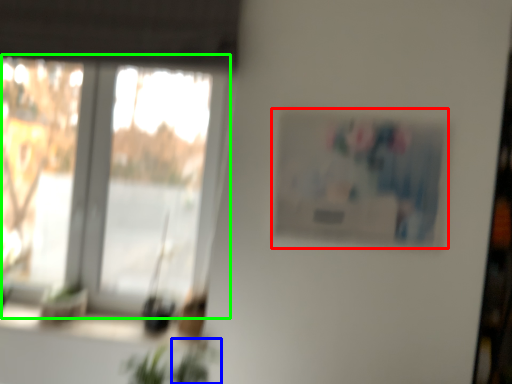
Question: Estimate the real-world distances between objects in this image. Which object is closer to picture frame (highlighted by a red box), plant (highlighted by a blue box) or window (highlighted by a green box)?

Choices:
 (A) plant
 (B) window

Answer: (B)